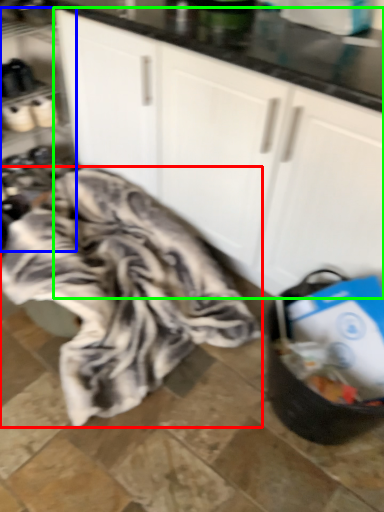
Question: Considering the real-world distances, which object is closest to blanket (highlighted by a red box)? shelf (highlighted by a blue box) or cabinetry (highlighted by a green box).

Choices:
 (A) shelf
 (B) cabinetry

Answer: (B)